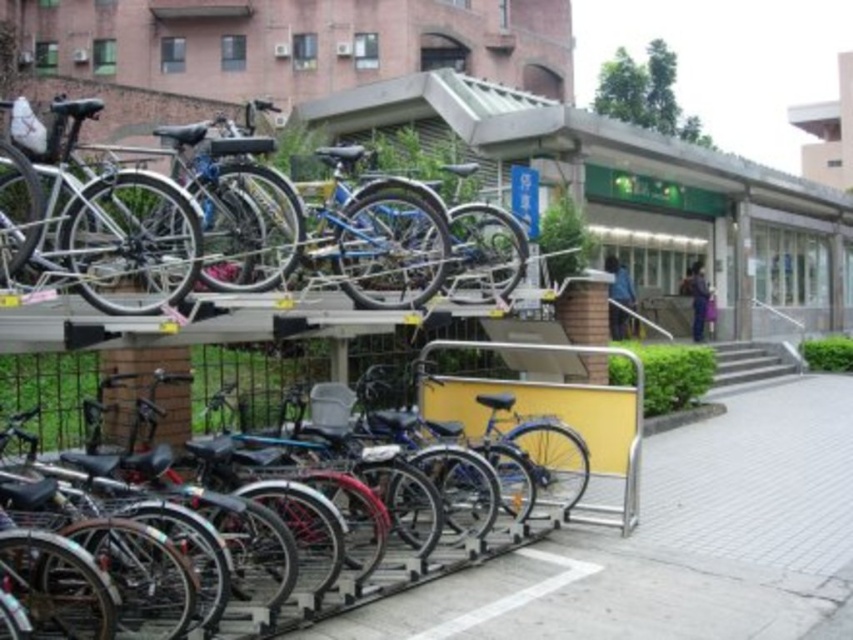
You are a delivery person trying to park your silver metallic bicycle at upper left. There is a metallic silver bicycle at center already parked in the spot you want. Can you fit your bicycle there without moving the existing one?

The silver metallic bicycle at upper left might be wider than the metallic silver bicycle at center, so there is a possibility it won not fit without moving the existing one.